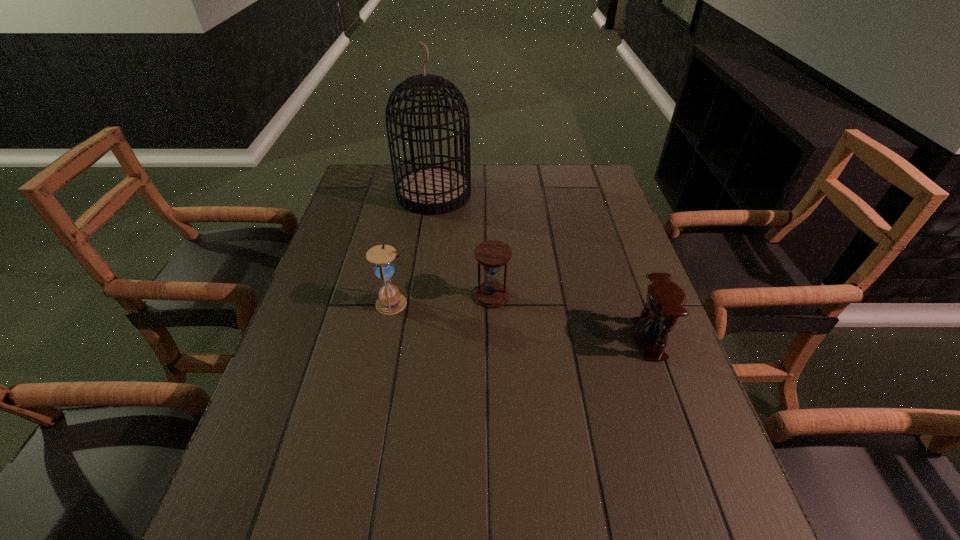
Identify the location of vacant space located 0.390m on the back of the second object from right to left. (490, 202).

Where is `object that is at the far edge`? This screenshot has height=540, width=960. object that is at the far edge is located at coordinates (432, 190).

Image resolution: width=960 pixels, height=540 pixels. Identify the location of object located at the right edge. (665, 299).

Locate an element on the screen. free region at the left edge of the desktop is located at coordinates (351, 356).

The width and height of the screenshot is (960, 540). What are the coordinates of `vacant space at the right edge of the desktop` in the screenshot? It's located at (623, 391).

This screenshot has width=960, height=540. I want to click on vacant region between the birdcage and the rightmost hourglass, so click(x=541, y=267).

Find the location of a particular element. The height and width of the screenshot is (540, 960). empty space between the second object from right to left and the nearest object is located at coordinates (570, 318).

Locate an element on the screen. The height and width of the screenshot is (540, 960). blank region between the tallest hourglass and the rightmost hourglass is located at coordinates (521, 321).

Locate an element on the screen. This screenshot has height=540, width=960. free space between the nearest object and the third object from left to right is located at coordinates (570, 318).

Image resolution: width=960 pixels, height=540 pixels. What are the coordinates of `empty space that is in between the birdcage and the leftmost hourglass` in the screenshot? It's located at (414, 249).